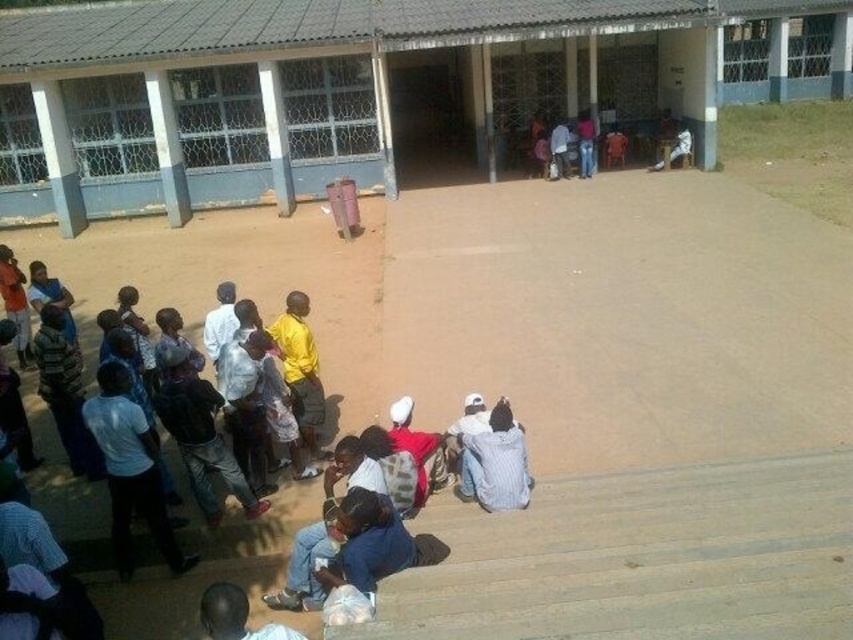
Question: Does gray concrete building at center appear on the left side of dark blue shirt at lower left?

Choices:
 (A) yes
 (B) no

Answer: (B)

Question: Among these objects, which one is farthest from the camera?

Choices:
 (A) gray concrete building at center
 (B) dark blue shirt at lower left

Answer: (A)

Question: Can you confirm if gray concrete building at center is thinner than dark blue shirt at lower left?

Choices:
 (A) yes
 (B) no

Answer: (B)

Question: Which point is closer to the camera taking this photo?

Choices:
 (A) (33, 396)
 (B) (805, 22)

Answer: (A)

Question: Does gray concrete building at center appear under dark blue shirt at lower left?

Choices:
 (A) yes
 (B) no

Answer: (B)